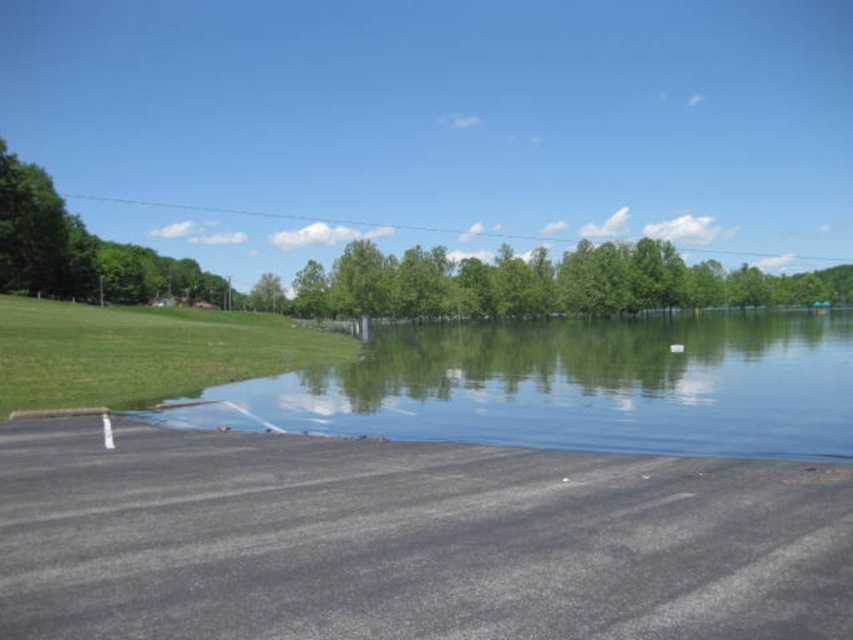
Question: Can you confirm if clear water at lower center is positioned below green leafy trees at center?

Choices:
 (A) yes
 (B) no

Answer: (A)

Question: Does clear water at lower center have a smaller size compared to green leafy trees at center?

Choices:
 (A) yes
 (B) no

Answer: (A)

Question: Can you confirm if clear water at lower center is positioned to the right of green leafy trees at center?

Choices:
 (A) yes
 (B) no

Answer: (B)